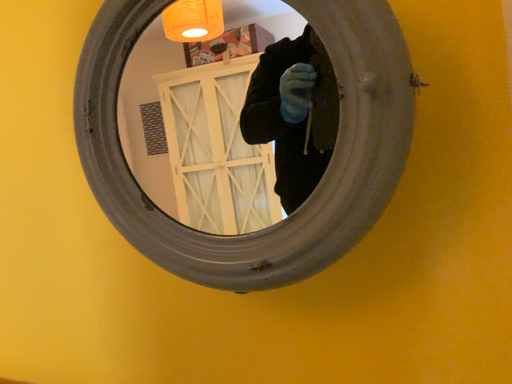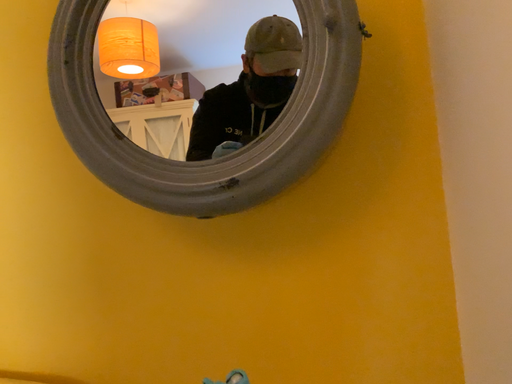
Question: How did the camera likely rotate when shooting the video?

Choices:
 (A) rotated right
 (B) rotated left

Answer: (A)